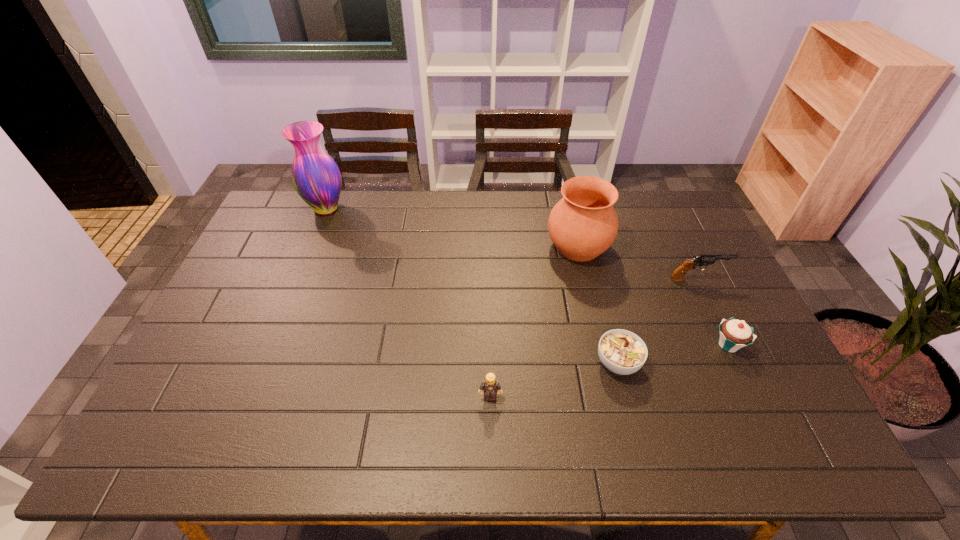
Locate an element on the screen. The width and height of the screenshot is (960, 540). free space located 0.060m on the front of the pottery is located at coordinates (587, 284).

I want to click on free space located in front of the nearest object, so click(x=491, y=423).

Where is `free point located on the front of the cupcake`? This screenshot has width=960, height=540. free point located on the front of the cupcake is located at coordinates (753, 396).

Where is `vacant space located on the left of the shortest object`? This screenshot has height=540, width=960. vacant space located on the left of the shortest object is located at coordinates (542, 363).

Identify the location of vase situated at the far edge. The image size is (960, 540). (316, 177).

Find the location of a particular element. The width and height of the screenshot is (960, 540). pottery at the far edge is located at coordinates (583, 224).

Find the location of a particular element. object present at the left edge is located at coordinates (316, 177).

Where is `gun that is at the right edge`? gun that is at the right edge is located at coordinates (704, 259).

The image size is (960, 540). I want to click on cupcake present at the right edge, so click(734, 334).

Image resolution: width=960 pixels, height=540 pixels. Find the location of `object that is at the far left corner`. object that is at the far left corner is located at coordinates (316, 177).